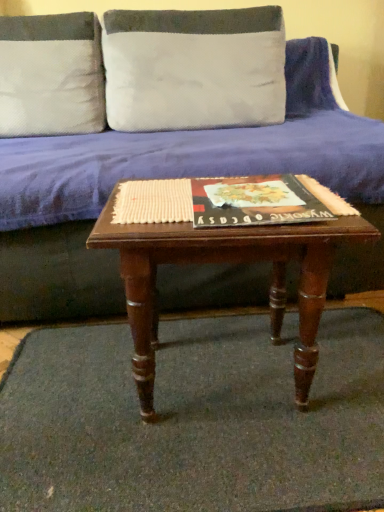
Question: Is white textured pillow at upper left, marked as the first pillow in a left-to-right arrangement, taller than mahogany wood coffee table at center?

Choices:
 (A) no
 (B) yes

Answer: (B)

Question: Does white textured pillow at upper left, the 2th pillow from the right, touch mahogany wood coffee table at center?

Choices:
 (A) no
 (B) yes

Answer: (A)

Question: Could mahogany wood coffee table at center be considered to be inside white textured pillow at upper left, marked as the first pillow in a left-to-right arrangement?

Choices:
 (A) no
 (B) yes

Answer: (A)

Question: Can you confirm if white textured pillow at upper left, the 2th pillow from the right, is shorter than mahogany wood coffee table at center?

Choices:
 (A) no
 (B) yes

Answer: (A)

Question: Can you confirm if white textured pillow at upper left, the 2th pillow from the right, is thinner than mahogany wood coffee table at center?

Choices:
 (A) no
 (B) yes

Answer: (B)

Question: Could you tell me if white textured pillow at upper left, the 2th pillow from the right, is facing mahogany wood coffee table at center?

Choices:
 (A) yes
 (B) no

Answer: (A)

Question: Is white textured pillow at upper left, marked as the first pillow in a left-to-right arrangement, next to green carpet at center?

Choices:
 (A) no
 (B) yes

Answer: (A)

Question: Does white textured pillow at upper left, the 2th pillow from the right, appear on the left side of green carpet at center?

Choices:
 (A) no
 (B) yes

Answer: (B)

Question: From the image's perspective, is white textured pillow at upper left, marked as the first pillow in a left-to-right arrangement, over green carpet at center?

Choices:
 (A) yes
 (B) no

Answer: (A)

Question: Can green carpet at center be found inside white textured pillow at upper left, the 2th pillow from the right?

Choices:
 (A) yes
 (B) no

Answer: (B)

Question: Is white textured pillow at upper left, marked as the first pillow in a left-to-right arrangement, taller than green carpet at center?

Choices:
 (A) yes
 (B) no

Answer: (A)

Question: Considering the relative sizes of white textured pillow at upper left, marked as the first pillow in a left-to-right arrangement, and green carpet at center in the image provided, is white textured pillow at upper left, marked as the first pillow in a left-to-right arrangement, smaller than green carpet at center?

Choices:
 (A) no
 (B) yes

Answer: (A)

Question: Is blue fabric couch at center completely or partially outside of mahogany wood coffee table at center?

Choices:
 (A) no
 (B) yes

Answer: (B)